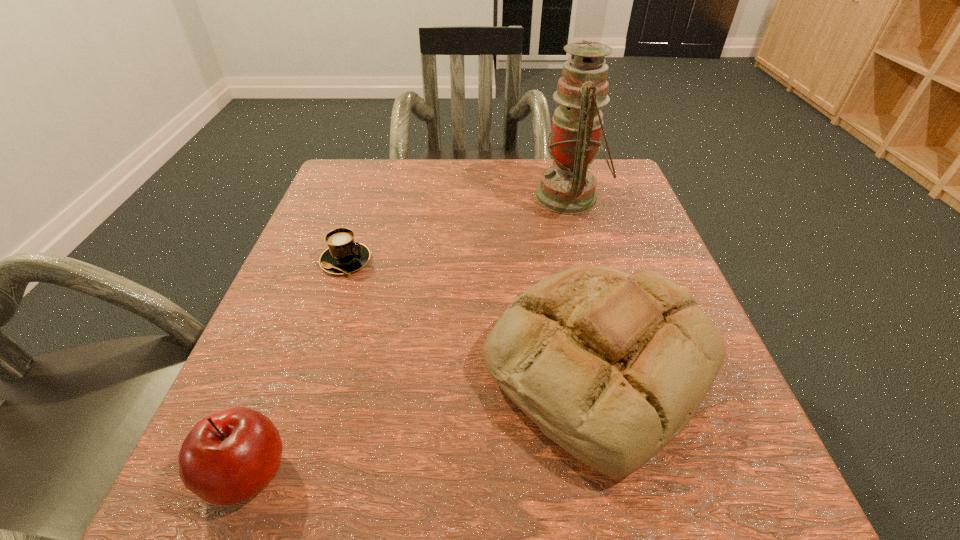
Find the location of a particular element. oil lamp is located at coordinates tap(569, 187).

At what (x,y) coordinates should I click in order to perform the action: click on the tallest object. Please return your answer as a coordinate pair (x, y). The image size is (960, 540). Looking at the image, I should click on (569, 187).

This screenshot has height=540, width=960. Identify the location of the third shortest object. (611, 366).

Image resolution: width=960 pixels, height=540 pixels. Identify the location of apple. (228, 457).

At what (x,y) coordinates should I click in order to perform the action: click on the third nearest object. Please return your answer as a coordinate pair (x, y). Image resolution: width=960 pixels, height=540 pixels. Looking at the image, I should click on (344, 256).

This screenshot has width=960, height=540. I want to click on cappuccino, so click(344, 256).

Where is `vacant position located 0.210m on the left of the oil lamp`? This screenshot has width=960, height=540. vacant position located 0.210m on the left of the oil lamp is located at coordinates (444, 197).

This screenshot has width=960, height=540. I want to click on vacant space located 0.380m on the back of the bread, so click(x=554, y=176).

You are a GUI agent. You are given a task and a screenshot of the screen. Output one action in this format:
    pyautogui.click(x=<x>, y=<y>)
    Task: Click on the vacant space located on the back of the apple
    The width and height of the screenshot is (960, 540).
    Given the screenshot: What is the action you would take?
    pyautogui.click(x=313, y=303)

The width and height of the screenshot is (960, 540). I want to click on blank space located 0.290m on the front of the shortest object, so click(290, 424).